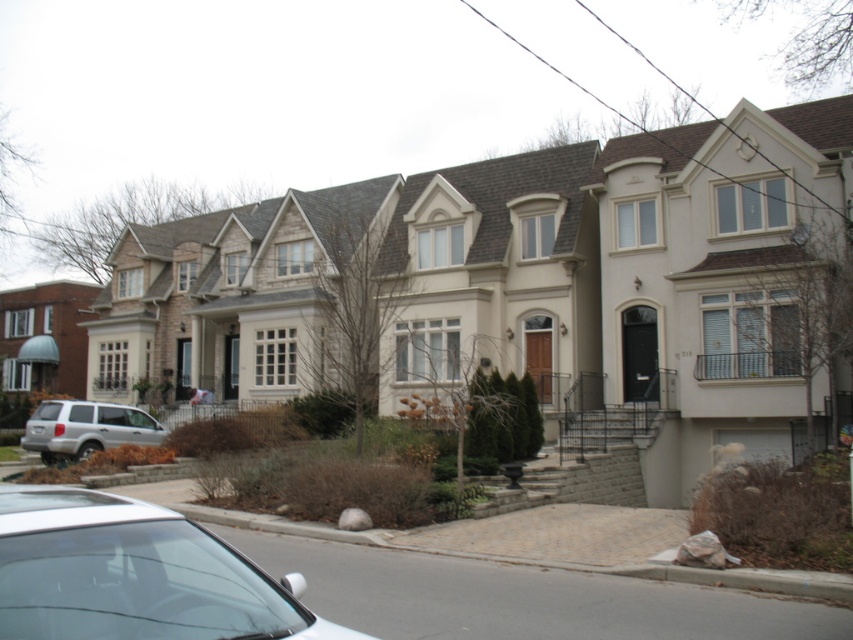
You are standing at the center of the image. Which direction should you walk to reach the white glossy car at lower left?

You should walk towards the lower left direction to reach the white glossy car at lower left.

You are a delivery person arriving at this suburban neighborhood. You need to park your van between the white glossy car at lower left and the silver metallic suv at lower left. Is there enough space between them for your van?

The white glossy car at lower left is closer to the viewer than the silver metallic suv at lower left, so the distance between them may vary depending on their actual positions. Without specific measurements, it is uncertain if there is enough space for the van.

You are a delivery person approaching the houses and need to park your vehicle. You see a white glossy car at lower left and a silver metallic suv at lower left. Which vehicle is parked higher up on the driveway?

The white glossy car at lower left is parked higher up on the driveway because it is above the silver metallic suv at lower left.